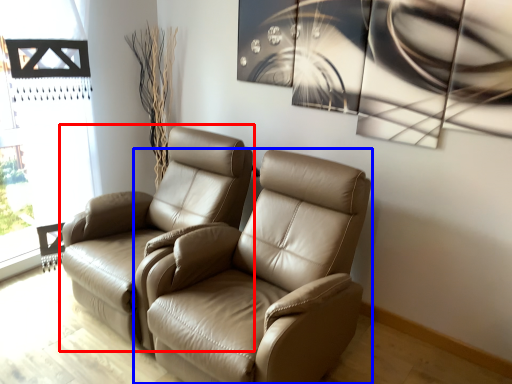
Question: Which object is closer to the camera taking this photo, chair (highlighted by a red box) or chair (highlighted by a blue box)?

Choices:
 (A) chair
 (B) chair

Answer: (B)